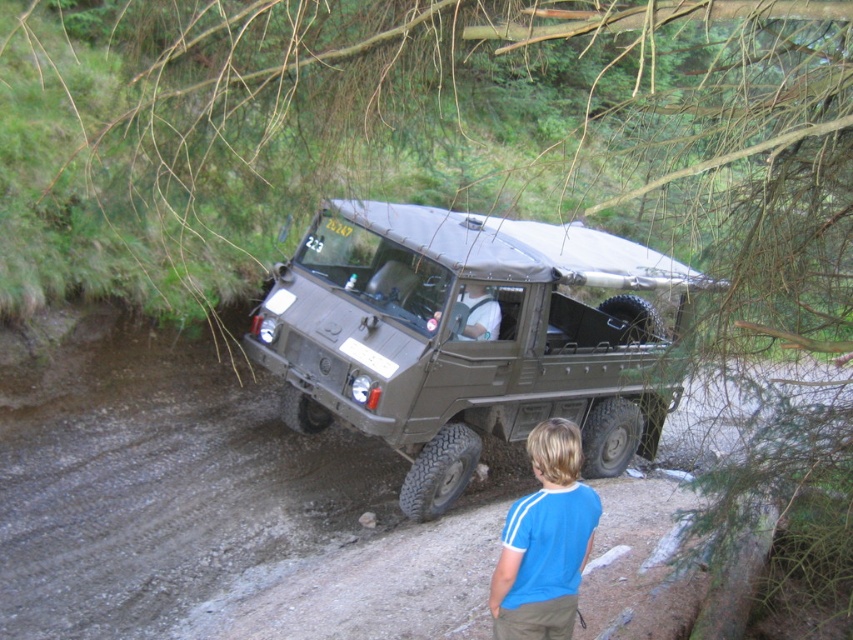
You are a photographer trying to capture a photo of the matte green military vehicle at center and the blue cotton shirt at lower center. Since you want both subjects to appear proportionally sized in the photo, which subject should you move closer to the camera?

The blue cotton shirt at lower center should be moved closer to the camera because the matte green military vehicle at center is bigger than blue cotton shirt at lower center, so moving the smaller object closer would help balance their sizes in the photo.

You are a photographer trying to capture a photo of the matte green military vehicle at center and the blue cotton shirt at lower center. If you want to ensure both subjects are in focus, which one should you focus on first considering their heights?

The matte green military vehicle at center is taller than the blue cotton shirt at lower center, so you should focus on the matte green military vehicle at center first to ensure both are in focus.

You are standing at the point marked by coordinates point (469, 337) in the image. What object is directly in front of you?

The point (469, 337) indicates the matte green military vehicle at center, so the object directly in front of you is the matte green military vehicle at center.